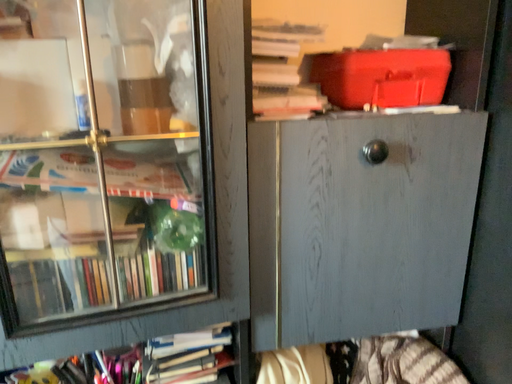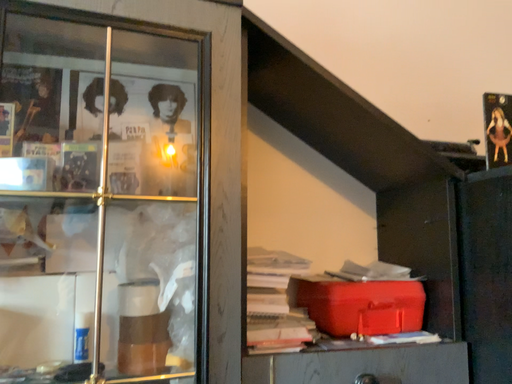
Question: How did the camera likely rotate when shooting the video?

Choices:
 (A) rotated upward
 (B) rotated downward

Answer: (A)